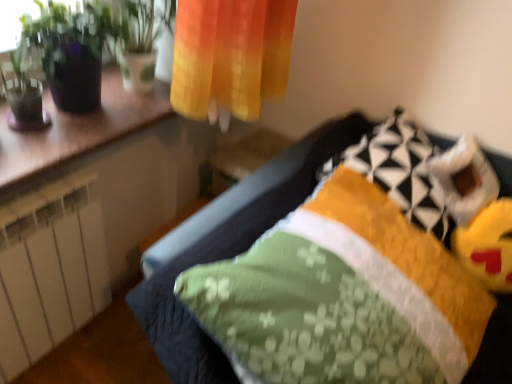
Locate an element on the screen. The height and width of the screenshot is (384, 512). vacant space underneath green glossy plant at upper left (from a real-world perspective) is located at coordinates (82, 109).